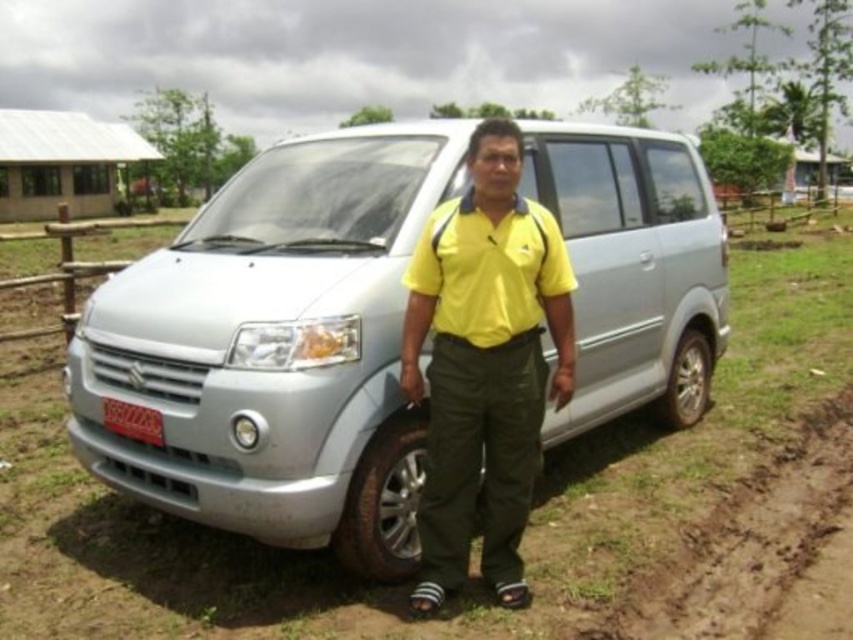
You are a photographer trying to capture the man in the yellow matte shirt at center and the black rubber tire at lower center in the same frame. Which object is wider?

The yellow matte shirt at center is wider than the black rubber tire at lower center.

You are a photographer trying to position a tripod to capture the silver metallic van at center. The camera requires the tripod to be placed exactly at the van location coordinates. What are the coordinates you should input into the camera system?

The coordinates for the silver metallic van at center are at point (276, 349), so you should input those coordinates into the camera system.